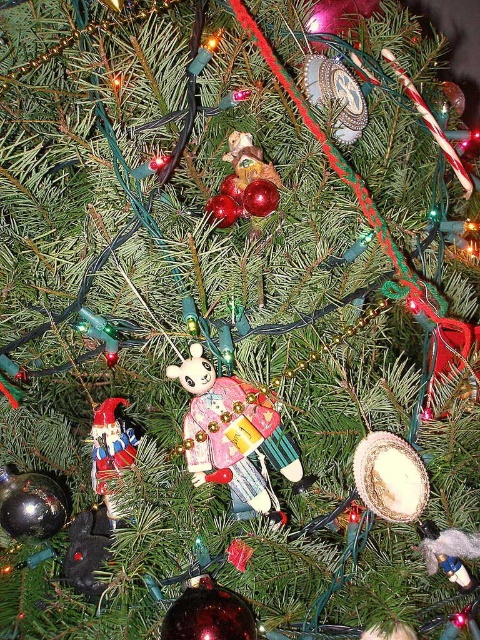
Who is positioned more to the left, wooden nutcracker at center or shiny metallic nutcracker at lower left?

shiny metallic nutcracker at lower left is more to the left.

Can you confirm if wooden nutcracker at center is positioned to the right of shiny metallic nutcracker at lower left?

Correct, you'll find wooden nutcracker at center to the right of shiny metallic nutcracker at lower left.

Does point (239, 452) come farther from viewer compared to point (108, 435)?

That is False.

The height and width of the screenshot is (640, 480). What are the coordinates of `wooden nutcracker at center` in the screenshot? It's located at (232, 433).